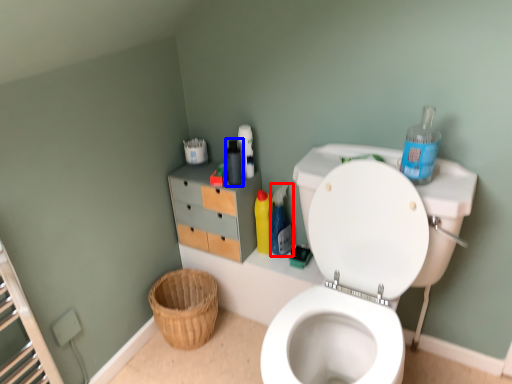
Question: Which point is further to the camera, cleaning product (highlighted by a red box) or bottle (highlighted by a blue box)?

Choices:
 (A) cleaning product
 (B) bottle

Answer: (A)